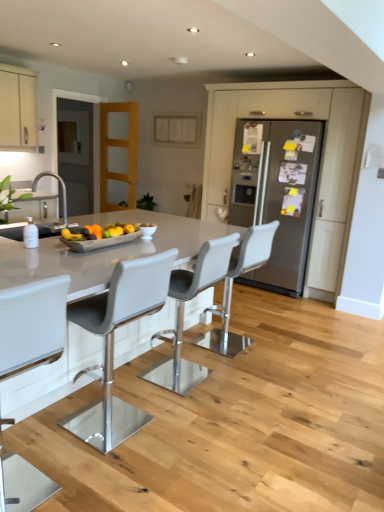
What are the coordinates of `vacant area to the right of white leather bar stool at center, the first chair viewed from the back` in the screenshot? It's located at (279, 348).